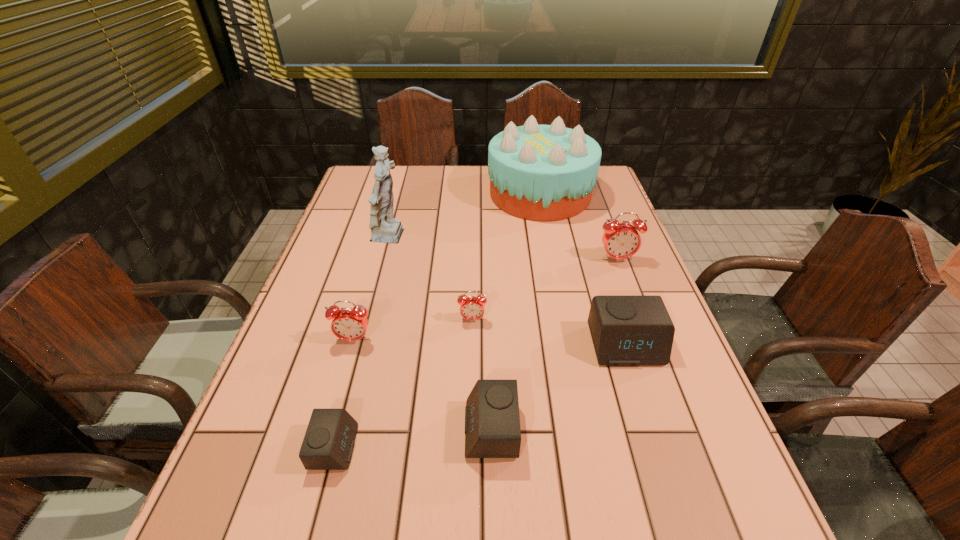
Locate which object ranks third in proximity to the second biggest red alarm clock. Please provide its 2D coordinates. Your answer should be formatted as a tuple, i.e. [(x, y)], where the tuple contains the x and y coordinates of a point satisfying the conditions above.

[(492, 421)]

Find the location of `object that stands as the fourth closest to the nearest red alarm clock`. object that stands as the fourth closest to the nearest red alarm clock is located at coordinates (386, 229).

Find the location of `alarm clock that is the second closest to the tallest object`. alarm clock that is the second closest to the tallest object is located at coordinates (348, 324).

Locate which alarm clock is the third closest to the rightmost black alarm clock. Please provide its 2D coordinates. Your answer should be formatted as a tuple, i.e. [(x, y)], where the tuple contains the x and y coordinates of a point satisfying the conditions above.

[(471, 308)]

Locate which red alarm clock ranks third in proximity to the second black alarm clock from right to left. Please provide its 2D coordinates. Your answer should be formatted as a tuple, i.e. [(x, y)], where the tuple contains the x and y coordinates of a point satisfying the conditions above.

[(621, 240)]

Identify the location of red alarm clock that is the closest to the biggest black alarm clock. (621, 240).

Find the location of `the third closest black alarm clock to the biggest red alarm clock`. the third closest black alarm clock to the biggest red alarm clock is located at coordinates (328, 444).

This screenshot has height=540, width=960. What are the coordinates of `the third closest black alarm clock to the farthest object` in the screenshot? It's located at (328, 444).

Locate an element on the screen. The image size is (960, 540). free spot that satisfies the following two spatial constraints: 1. on the front side of the cake; 2. on the front-facing side of the tallest object is located at coordinates (549, 238).

Where is `vacant position in the image that satisfies the following two spatial constraints: 1. on the face of the farthest alarm clock; 2. on the front-facing side of the shortest alarm clock`? vacant position in the image that satisfies the following two spatial constraints: 1. on the face of the farthest alarm clock; 2. on the front-facing side of the shortest alarm clock is located at coordinates (687, 447).